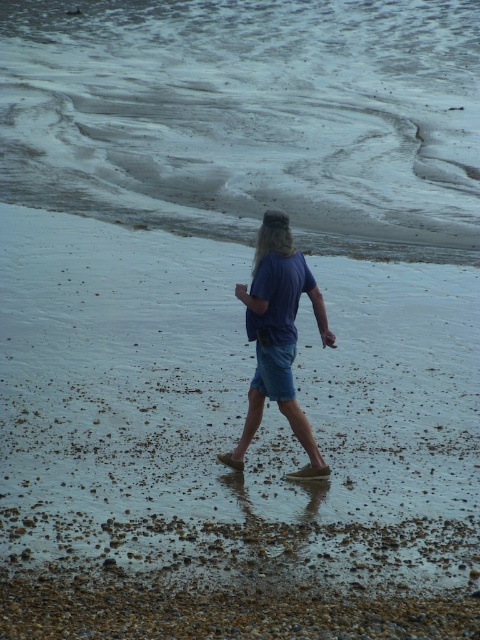
Which is above, sandy water at center or blue denim shorts at center?

sandy water at center is higher up.

Is sandy water at center shorter than blue denim shorts at center?

In fact, sandy water at center may be taller than blue denim shorts at center.

Who is more forward, (431,208) or (313,468)?

Point (313,468)

Find the location of a particular element. sandy water at center is located at coordinates (250, 118).

Is smooth sand beach at center to the right of blue denim shorts at center from the viewer's perspective?

Yes, smooth sand beach at center is to the right of blue denim shorts at center.

Based on the photo, is smooth sand beach at center shorter than blue denim shorts at center?

Incorrect, smooth sand beach at center's height does not fall short of blue denim shorts at center's.

Is point (55, 384) farther from camera compared to point (321, 296)?

Yes, it is.

Where is `smooth sand beach at center`? smooth sand beach at center is located at coordinates click(x=228, y=444).

Between smooth sand beach at center and blonde hair at center, which one has less height?

Standing shorter between the two is blonde hair at center.

Does smooth sand beach at center appear under blonde hair at center?

Yes, smooth sand beach at center is below blonde hair at center.

Locate an element on the screen. smooth sand beach at center is located at coordinates (228, 444).